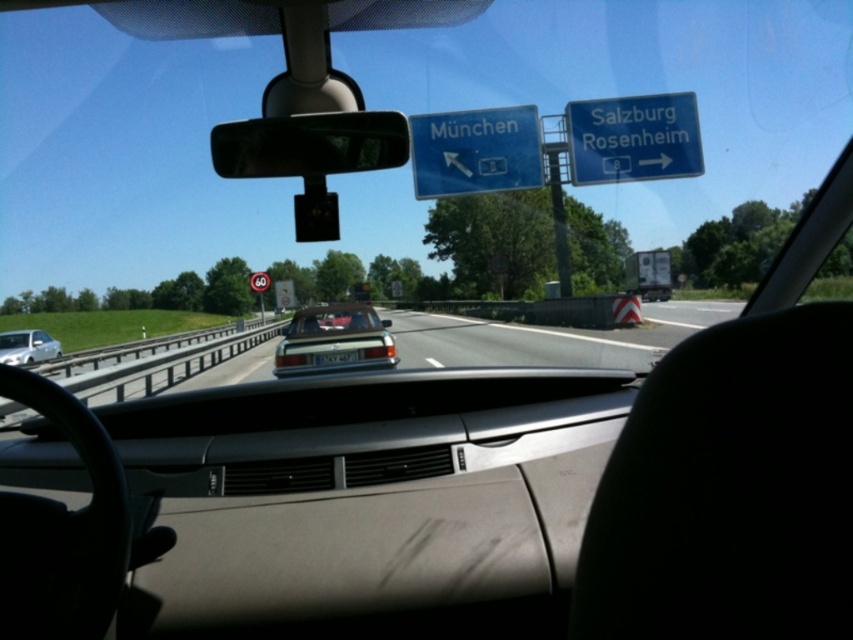
Who is higher up, black plastic view mirror at center or white glossy sedan at left?

black plastic view mirror at center is above.

Measure the distance from black plastic view mirror at center to white glossy sedan at left.

black plastic view mirror at center and white glossy sedan at left are 19.69 meters apart.

Is point (270, 147) less distant than point (25, 355)?

Yes, it is.

The image size is (853, 640). Find the location of `black plastic view mirror at center`. black plastic view mirror at center is located at coordinates (311, 156).

What do you see at coordinates (474, 150) in the screenshot? I see `blue glossy sign at upper center` at bounding box center [474, 150].

Is point (451, 140) closer to camera compared to point (308, 364)?

No, it is not.

This screenshot has width=853, height=640. I want to click on blue glossy sign at upper center, so [474, 150].

Between metallic silver car at center and black plastic view mirror at center, which one has more height?

metallic silver car at center is taller.

This screenshot has height=640, width=853. What do you see at coordinates (549, 337) in the screenshot?
I see `metallic silver car at center` at bounding box center [549, 337].

Does point (213, 371) come farther from viewer compared to point (265, 145)?

Yes, it is.

Find the location of `metallic silver car at center`. metallic silver car at center is located at coordinates (549, 337).